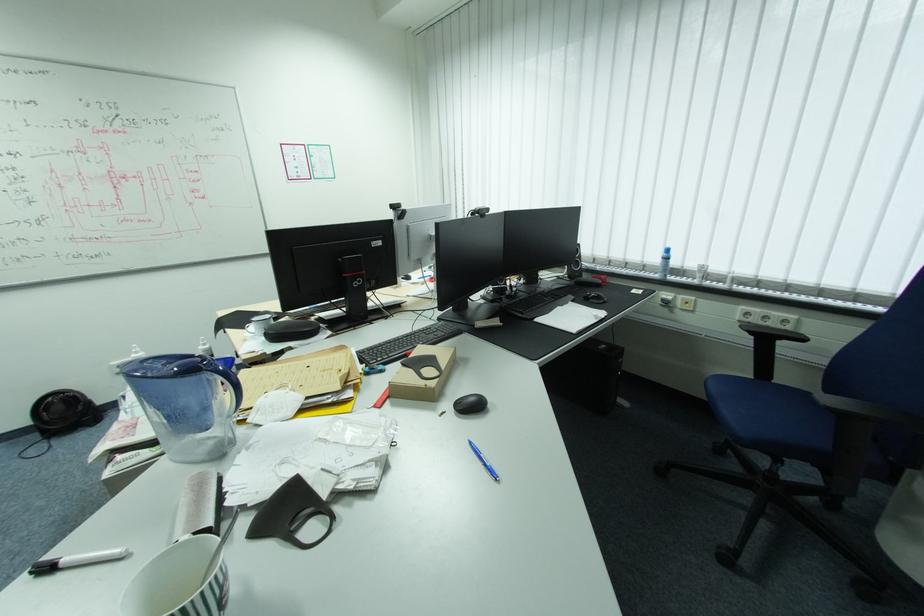
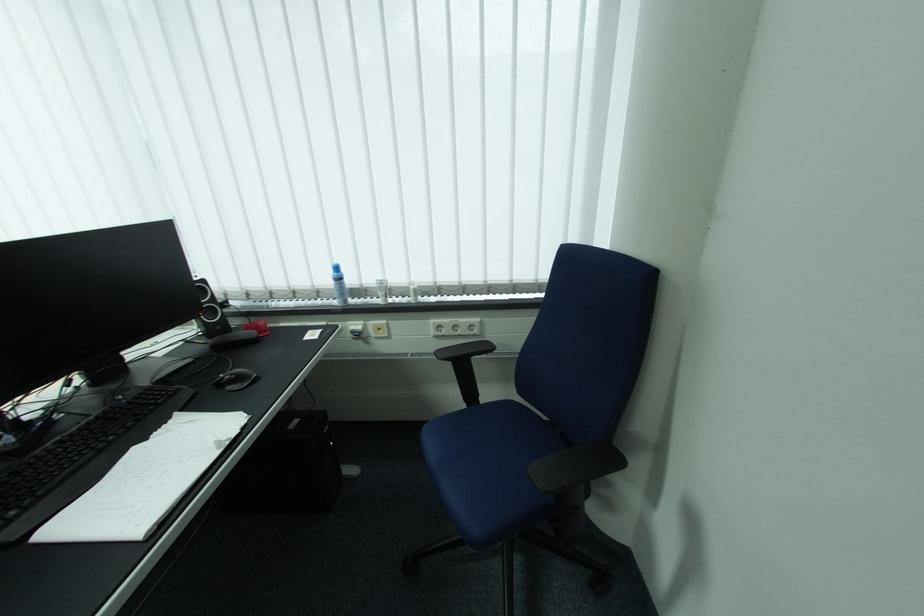
Locate, in the second image, the point that corresponds to (x=553, y=301) in the first image.

(117, 438)